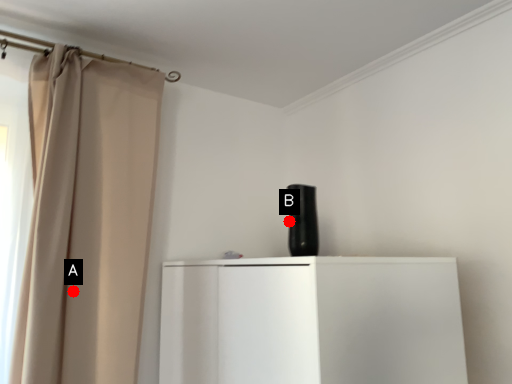
Question: Two points are circled on the image, labeled by A and B beside each circle. Which point is farther from the camera taking this photo?

Choices:
 (A) A is further
 (B) B is further

Answer: (B)